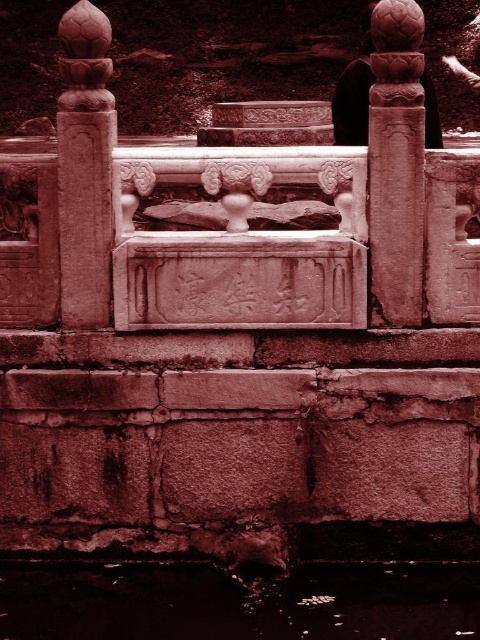
Does dark brown water at bottom lie in front of smooth stone pillar at right?

That is True.

Can you confirm if dark brown water at bottom is positioned below smooth stone pillar at right?

Yes.

The height and width of the screenshot is (640, 480). Identify the location of dark brown water at bottom. (239, 602).

Where is `dark brown water at bottom`? dark brown water at bottom is located at coordinates (239, 602).

Which of these two, dark brown water at bottom or carved stone pillar at upper left, stands shorter?

With less height is dark brown water at bottom.

Is dark brown water at bottom wider than carved stone pillar at upper left?

Yes, dark brown water at bottom is wider than carved stone pillar at upper left.

The image size is (480, 640). What do you see at coordinates (239, 602) in the screenshot?
I see `dark brown water at bottom` at bounding box center [239, 602].

You are a GUI agent. You are given a task and a screenshot of the screen. Output one action in this format:
    pyautogui.click(x=<x>, y=<y>)
    Task: Click on the dark brown water at bottom
    
    Given the screenshot: What is the action you would take?
    [x=239, y=602]

Can you confirm if smooth stone pillar at right is shorter than carved stone pillar at upper left?

Incorrect, smooth stone pillar at right's height does not fall short of carved stone pillar at upper left's.

Does point (399, 141) come behind point (59, 156)?

No, (399, 141) is in front of (59, 156).

The height and width of the screenshot is (640, 480). Find the location of `smooth stone pillar at right`. smooth stone pillar at right is located at coordinates (396, 164).